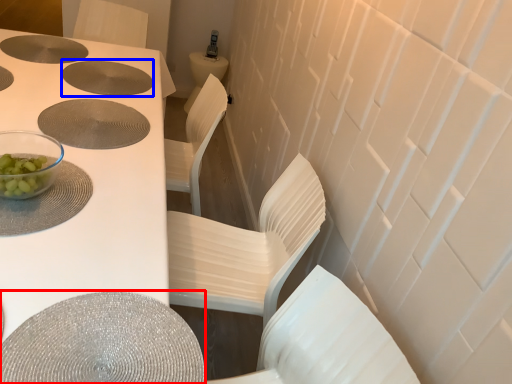
Question: Which point is further to the camera, round table (highlighted by a red box) or hole (highlighted by a blue box)?

Choices:
 (A) round table
 (B) hole

Answer: (B)